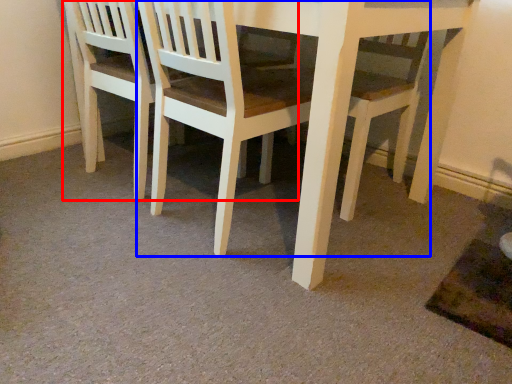
Question: Which object is closer to the camera taking this photo, chair (highlighted by a red box) or chair (highlighted by a blue box)?

Choices:
 (A) chair
 (B) chair

Answer: (B)